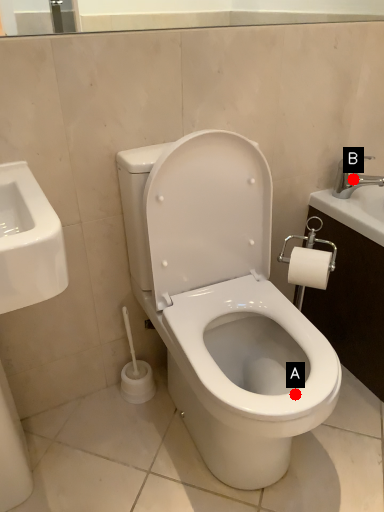
Question: Two points are circled on the image, labeled by A and B beside each circle. Which point is closer to the camera taking this photo?

Choices:
 (A) A is closer
 (B) B is closer

Answer: (A)